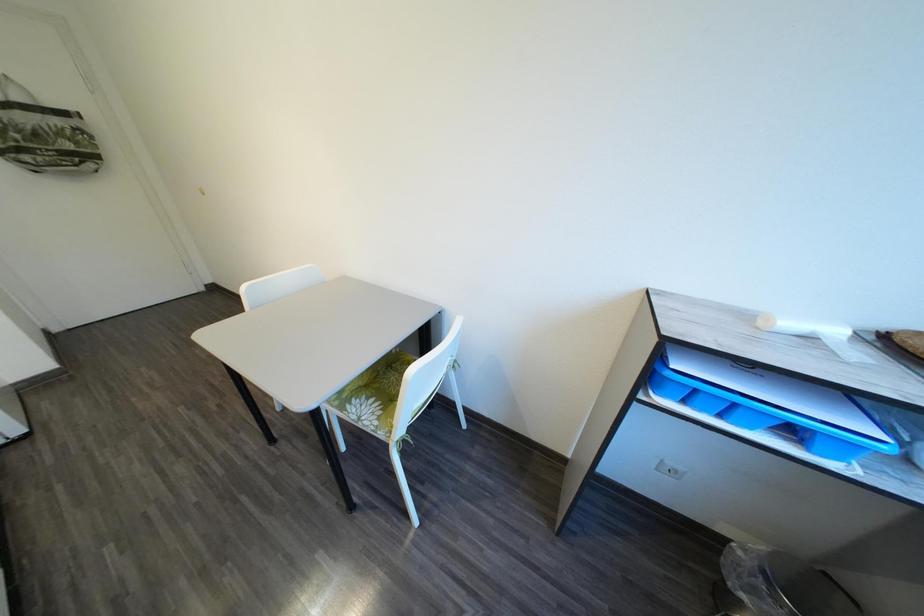
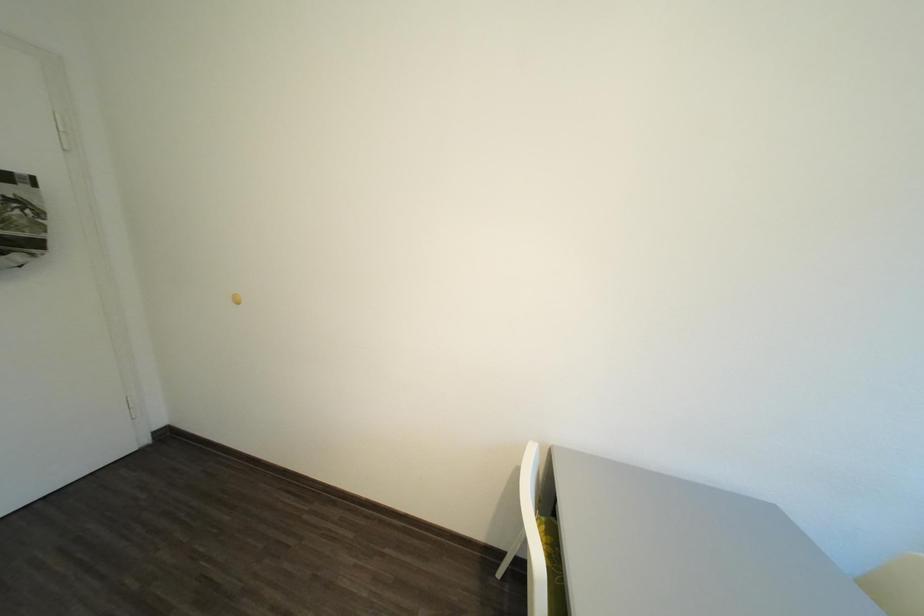
In a continuous first-person perspective shot, in which direction is the camera moving?

The movement direction of the cameraman is left, forward.